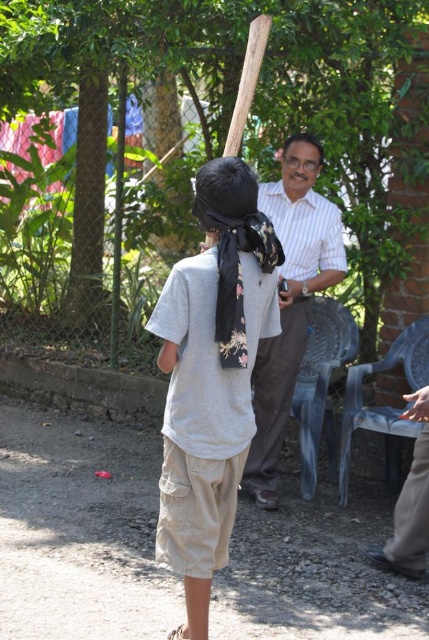
Question: Which object is positioned closest to the wooden baseball bat at upper center?

Choices:
 (A) gray cotton shirt at center
 (B) white striped shirt at center

Answer: (A)

Question: Is gray cotton shirt at center wider than wooden baseball bat at upper center?

Choices:
 (A) yes
 (B) no

Answer: (A)

Question: Estimate the real-world distances between objects in this image. Which object is farther from the white striped shirt at center?

Choices:
 (A) wooden baseball bat at upper center
 (B) gray cotton shirt at center

Answer: (B)

Question: Does gray cotton shirt at center have a greater width compared to wooden baseball bat at upper center?

Choices:
 (A) no
 (B) yes

Answer: (B)

Question: Which point is farther to the camera?

Choices:
 (A) wooden baseball bat at upper center
 (B) gray cotton shirt at center
 (C) white striped shirt at center

Answer: (C)

Question: Does white striped shirt at center appear on the right side of wooden baseball bat at upper center?

Choices:
 (A) no
 (B) yes

Answer: (B)